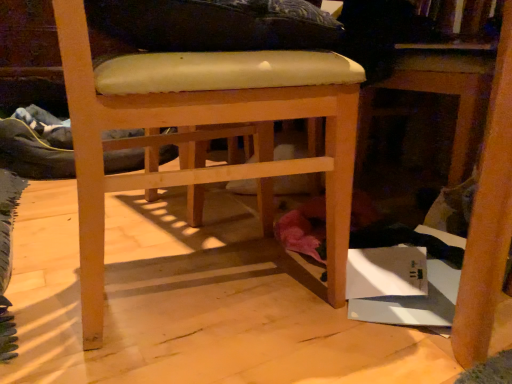
Identify the location of vacant space that is to the left of light brown wood chair at center. The width and height of the screenshot is (512, 384). (48, 269).